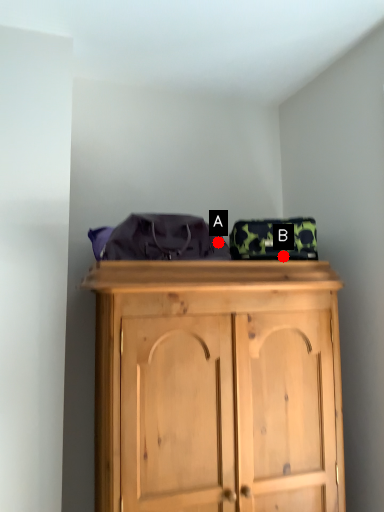
Question: Two points are circled on the image, labeled by A and B beside each circle. Which point appears closest to the camera in this image?

Choices:
 (A) A is closer
 (B) B is closer

Answer: (B)